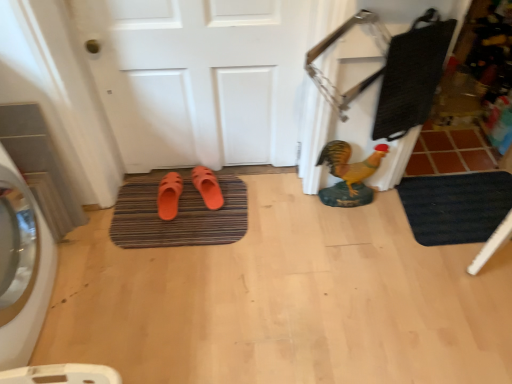
Question: Is orange rubber slipper at center, marked as the 2th footwear in a left-to-right arrangement, touching brown tile at right?

Choices:
 (A) no
 (B) yes

Answer: (A)

Question: Is orange rubber slipper at center, marked as the 2th footwear in a left-to-right arrangement, not near brown tile at right?

Choices:
 (A) no
 (B) yes

Answer: (B)

Question: From a real-world perspective, is orange rubber slipper at center, placed as the 1th footwear when sorted from right to left, located beneath brown tile at right?

Choices:
 (A) no
 (B) yes

Answer: (A)

Question: Would you say orange rubber slipper at center, marked as the 2th footwear in a left-to-right arrangement, is outside brown tile at right?

Choices:
 (A) no
 (B) yes

Answer: (B)

Question: Does orange rubber slipper at center, marked as the 2th footwear in a left-to-right arrangement, have a lesser width compared to brown tile at right?

Choices:
 (A) yes
 (B) no

Answer: (A)

Question: Looking at the image, does black rubber bath mat at lower right, positioned as the first bath mat in right-to-left order, seem bigger or smaller compared to brown tile at right?

Choices:
 (A) big
 (B) small

Answer: (B)

Question: Considering the positions of point (415, 190) and point (433, 147), is point (415, 190) closer or farther from the camera than point (433, 147)?

Choices:
 (A) farther
 (B) closer

Answer: (B)

Question: From a real-world perspective, relative to brown tile at right, is black rubber bath mat at lower right, positioned as the first bath mat in right-to-left order, vertically above or below?

Choices:
 (A) below
 (B) above

Answer: (B)

Question: Considering the positions of black rubber bath mat at lower right, which is counted as the second bath mat, starting from the left, and brown tile at right in the image, is black rubber bath mat at lower right, which is counted as the second bath mat, starting from the left, taller or shorter than brown tile at right?

Choices:
 (A) tall
 (B) short

Answer: (B)

Question: Would you say white matte door at center is inside or outside orange rubber slipper at center, marked as the 2th footwear in a right-to-left arrangement?

Choices:
 (A) inside
 (B) outside

Answer: (B)

Question: Considering the positions of white matte door at center and orange rubber slipper at center, marked as the 2th footwear in a right-to-left arrangement, in the image, is white matte door at center wider or thinner than orange rubber slipper at center, marked as the 2th footwear in a right-to-left arrangement,?

Choices:
 (A) wide
 (B) thin

Answer: (B)

Question: Is point (231, 117) closer or farther from the camera than point (177, 208)?

Choices:
 (A) farther
 (B) closer

Answer: (B)

Question: In the image, is white matte door at center positioned in front of or behind orange rubber slipper at center, marked as the 2th footwear in a right-to-left arrangement?

Choices:
 (A) front
 (B) behind

Answer: (A)

Question: In the image, is black rubber bath mat at lower right, which is counted as the second bath mat, starting from the left, on the left side or the right side of orange rubber slipper at center, marked as the 2th footwear in a left-to-right arrangement?

Choices:
 (A) right
 (B) left

Answer: (A)

Question: In terms of width, does black rubber bath mat at lower right, positioned as the first bath mat in right-to-left order, look wider or thinner when compared to orange rubber slipper at center, placed as the 1th footwear when sorted from right to left?

Choices:
 (A) thin
 (B) wide

Answer: (B)